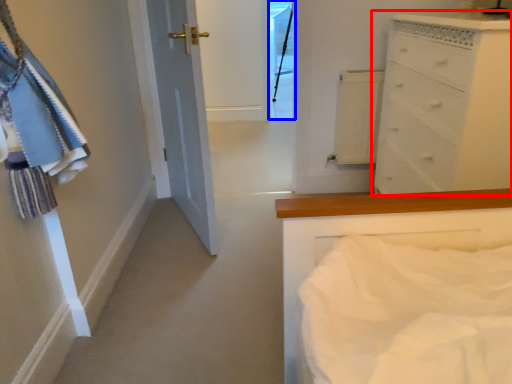
Question: Which point is further to the camera, chest of drawers (highlighted by a red box) or glass door (highlighted by a blue box)?

Choices:
 (A) chest of drawers
 (B) glass door

Answer: (B)